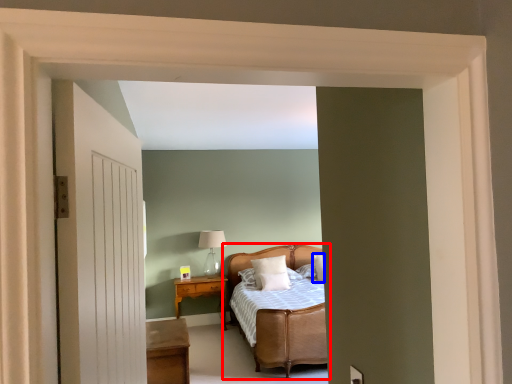
Question: Among these objects, which one is farthest to the camera, bed (highlighted by a red box) or pillow (highlighted by a blue box)?

Choices:
 (A) bed
 (B) pillow

Answer: (B)